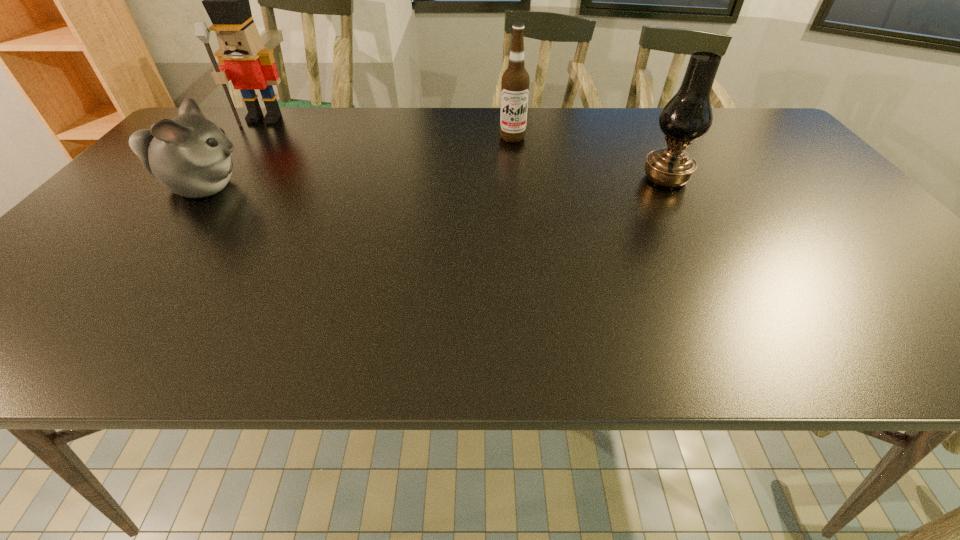
This screenshot has height=540, width=960. In order to click on alcohol that is at the far edge in this screenshot , I will do `click(515, 82)`.

The image size is (960, 540). I want to click on nutcracker that is at the left edge, so click(x=244, y=60).

The width and height of the screenshot is (960, 540). I want to click on hamster positioned at the left edge, so click(189, 155).

You are a GUI agent. You are given a task and a screenshot of the screen. Output one action in this format:
    pyautogui.click(x=<x>, y=<y>)
    Task: Click on the object present at the far left corner
    
    Given the screenshot: What is the action you would take?
    pyautogui.click(x=244, y=60)

Locate an element on the screen. vacant space at the far edge of the desktop is located at coordinates (325, 132).

I want to click on vacant space at the near edge of the desktop, so click(x=542, y=340).

Identify the location of free space at the left edge. (57, 318).

Image resolution: width=960 pixels, height=540 pixels. In the image, there is a desktop. Find the location of `blank space at the far right corner`. blank space at the far right corner is located at coordinates (722, 108).

Identify the location of vacant point located between the nutcracker and the rightmost object. The width and height of the screenshot is (960, 540). (465, 149).

Where is `free space between the farthest object and the hamster`? free space between the farthest object and the hamster is located at coordinates (233, 153).